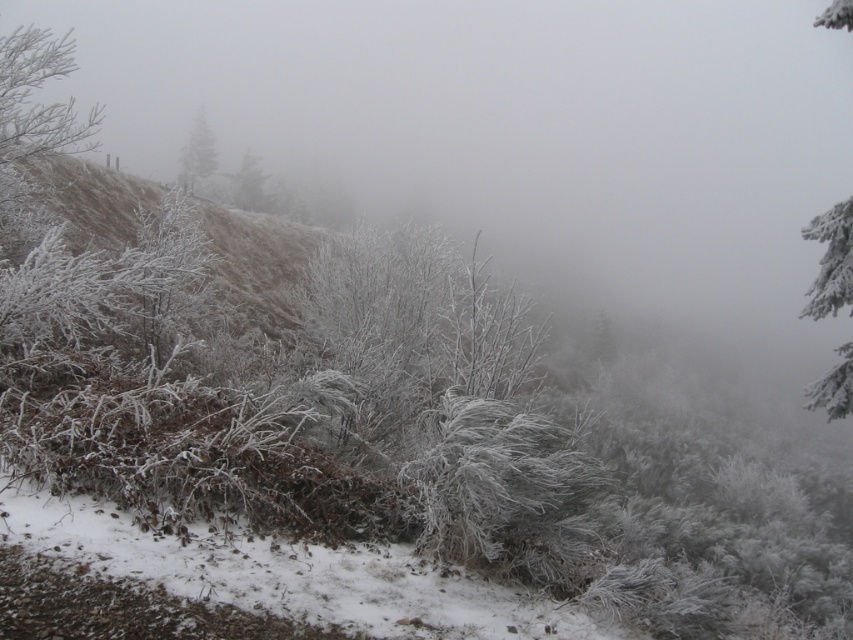
Question: Where is snow-covered evergreen tree at upper center located in relation to frosted evergreen tree at center in the image?

Choices:
 (A) left
 (B) right

Answer: (A)

Question: Does white frosty tree at right come in front of frosted evergreen tree at center?

Choices:
 (A) no
 (B) yes

Answer: (B)

Question: Among these points, which one is nearest to the camera?

Choices:
 (A) (181, 182)
 (B) (250, 205)

Answer: (B)

Question: In this image, where is white frosty tree at right located relative to snow-covered evergreen tree at upper center?

Choices:
 (A) right
 (B) left

Answer: (A)

Question: Which point is farther to the camera?

Choices:
 (A) white frosty tree at right
 (B) frosted evergreen tree at center
 (C) snow-covered evergreen tree at upper center

Answer: (B)

Question: Which object is closer to the camera taking this photo?

Choices:
 (A) white frosty tree at right
 (B) snow-covered evergreen tree at upper center
 (C) frosted evergreen tree at center

Answer: (A)